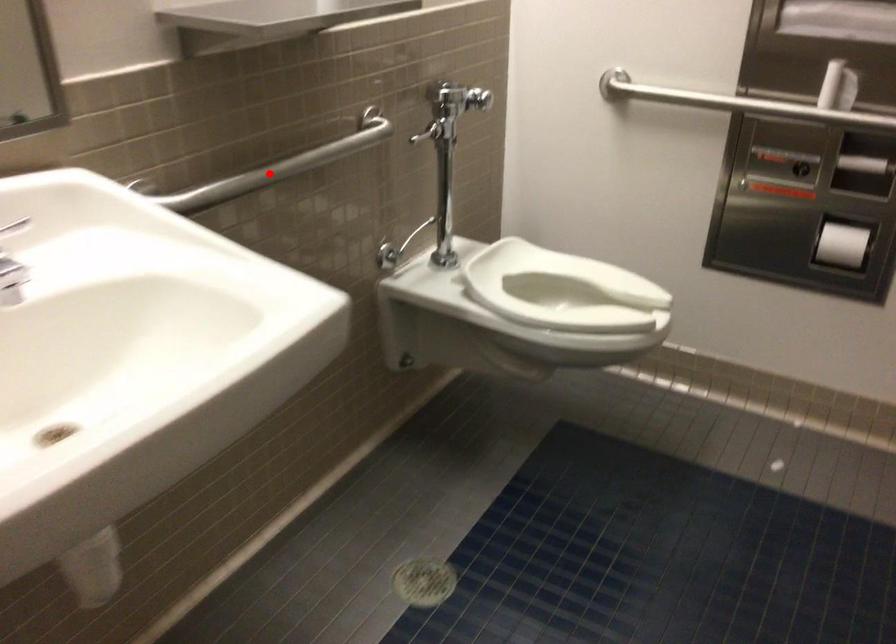
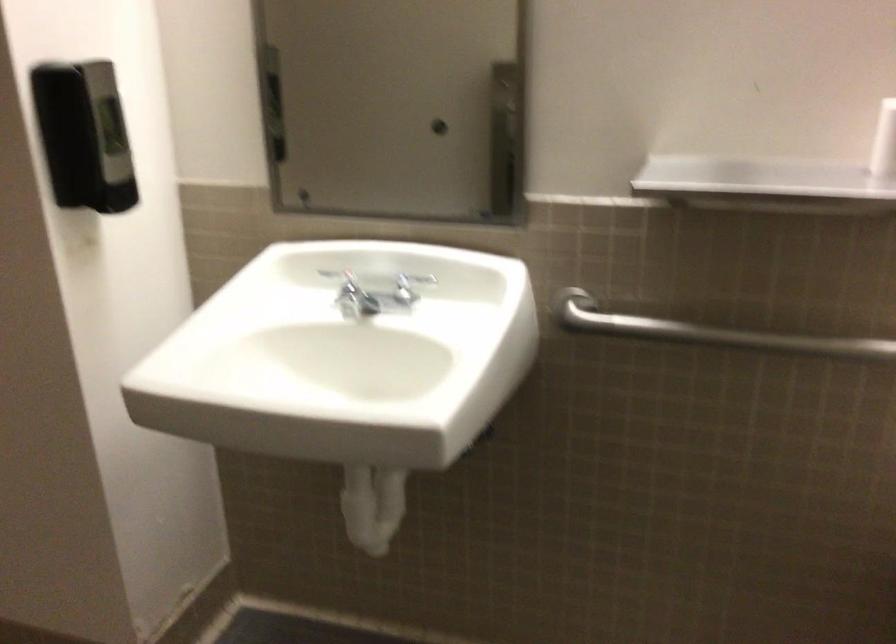
Locate, in the second image, the point that corresponds to the highlighted location in the first image.

(707, 332)